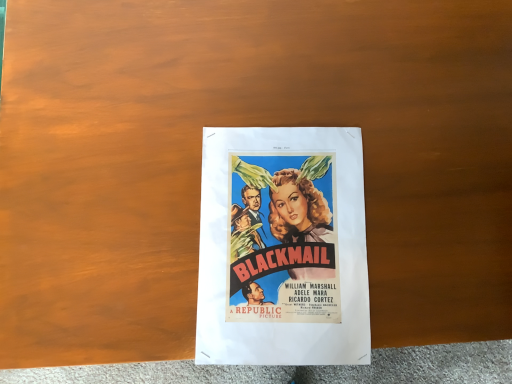
Where is `free space above matte paper poster at center (from a real-world perspective)`? The width and height of the screenshot is (512, 384). free space above matte paper poster at center (from a real-world perspective) is located at coordinates (283, 251).